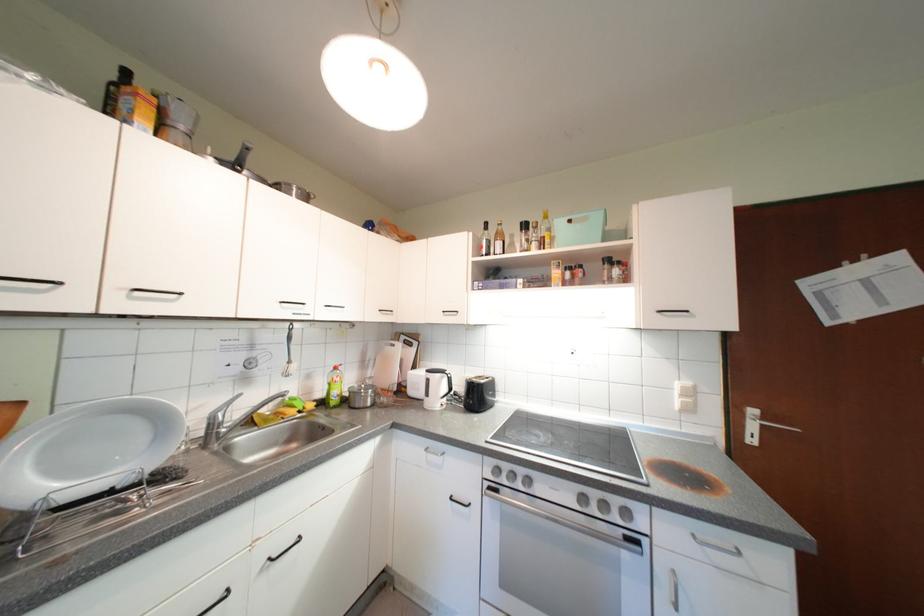
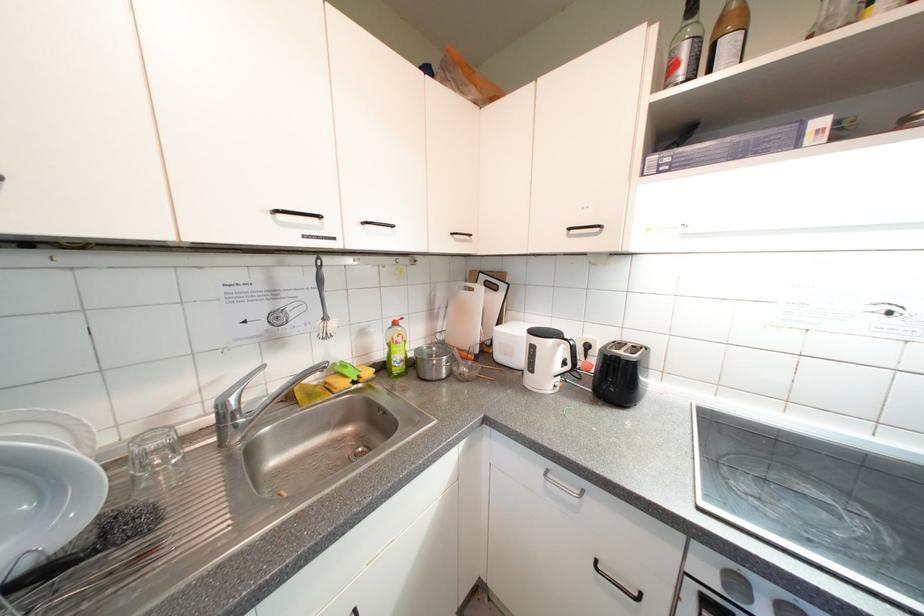
Where in the second image is the point corresponding to (505,236) from the first image?

(728, 23)